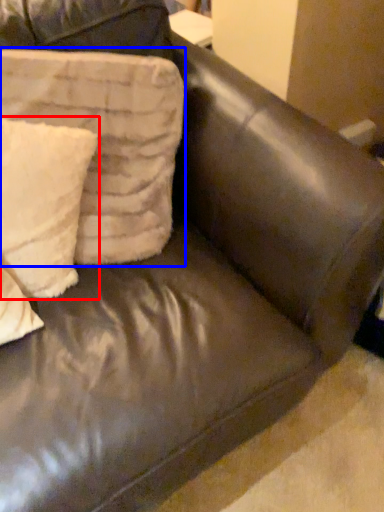
Question: Which object is further to the camera taking this photo, pillow (highlighted by a red box) or pillow (highlighted by a blue box)?

Choices:
 (A) pillow
 (B) pillow

Answer: (A)